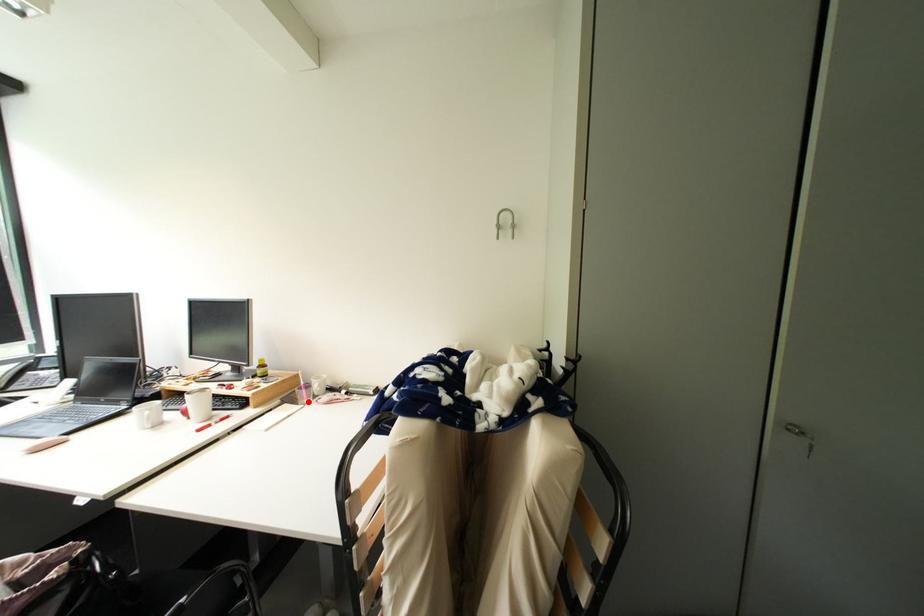
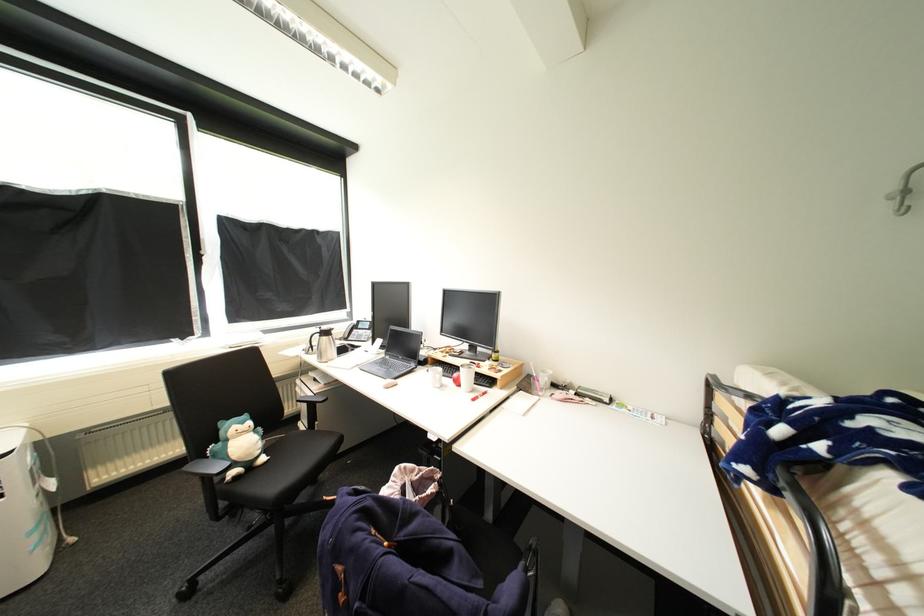
Locate, in the second image, the point that corresponds to the highlighted location in the first image.

(541, 392)